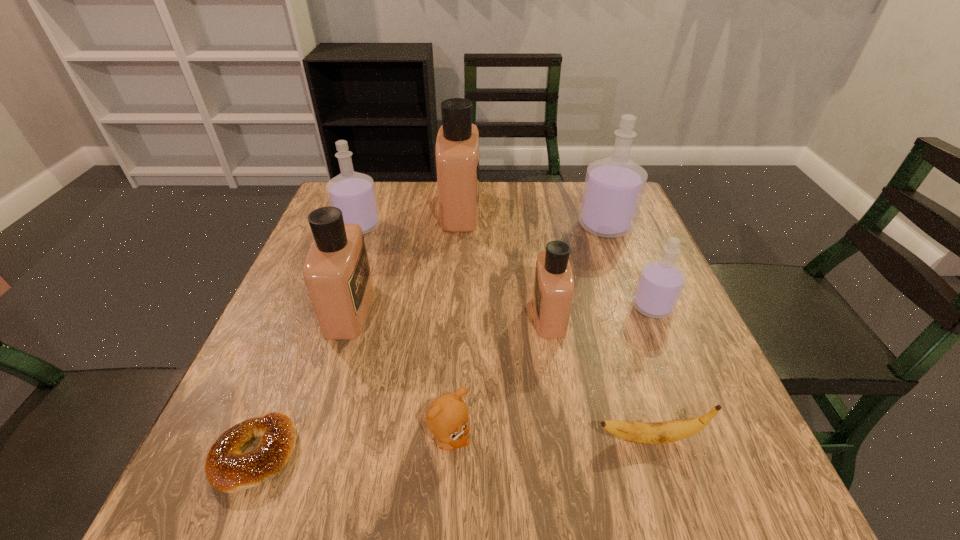
In order to click on vacant space situated 0.230m on the front label of the smallest beige perfume in this screenshot , I will do `click(424, 315)`.

You are a GUI agent. You are given a task and a screenshot of the screen. Output one action in this format:
    pyautogui.click(x=<x>, y=<y>)
    Task: Click on the vacant space located on the front of the smallest purple perfume
    
    Given the screenshot: What is the action you would take?
    pyautogui.click(x=697, y=415)

Image resolution: width=960 pixels, height=540 pixels. What are the coordinates of `free space located 0.290m on the face of the seventh tallest object` in the screenshot? It's located at (647, 440).

The height and width of the screenshot is (540, 960). I want to click on free space located on the peel of the banana from the top, so tap(523, 438).

The height and width of the screenshot is (540, 960). Identify the location of vacant space located on the peel of the banana from the top. (536, 438).

Locate an element on the screen. The image size is (960, 540). vacant area situated on the peel of the banana from the top is located at coordinates [x=492, y=438].

The image size is (960, 540). In order to click on vacant point located 0.110m on the back of the shortest object in this screenshot , I will do `click(291, 365)`.

What are the coordinates of `teddy bear present at the near edge` in the screenshot? It's located at (447, 418).

Where is `bagel located in the near edge section of the desktop`? bagel located in the near edge section of the desktop is located at coordinates (228, 469).

The width and height of the screenshot is (960, 540). What are the coordinates of `bagel that is positioned at the left edge` in the screenshot? It's located at (228, 469).